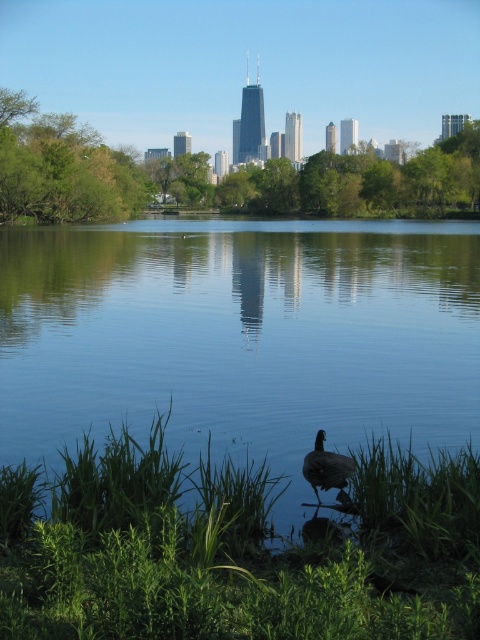
Is blue smooth water at center wider than brown feathered duck at lower center?

Correct, the width of blue smooth water at center exceeds that of brown feathered duck at lower center.

Can you confirm if blue smooth water at center is smaller than brown feathered duck at lower center?

Incorrect, blue smooth water at center is not smaller in size than brown feathered duck at lower center.

Is point (451, 294) positioned after point (337, 483)?

Yes, point (451, 294) is behind point (337, 483).

Identify the location of blue smooth water at center. The height and width of the screenshot is (640, 480). (240, 337).

Is point (358, 570) closer to viewer compared to point (315, 461)?

Yes, point (358, 570) is in front of point (315, 461).

Which is behind, point (233, 624) or point (331, 468)?

Point (331, 468)

Identify the location of green leafy grass at lower center. (236, 548).

Is blue smooth water at center further to the viewer compared to green leafy grass at lower center?

Yes, it is behind green leafy grass at lower center.

Which of these two, blue smooth water at center or green leafy grass at lower center, stands taller?

Standing taller between the two is blue smooth water at center.

Does point (43, 336) lie in front of point (149, 461)?

No, it is not.

The height and width of the screenshot is (640, 480). In order to click on blue smooth water at center in this screenshot , I will do `click(240, 337)`.